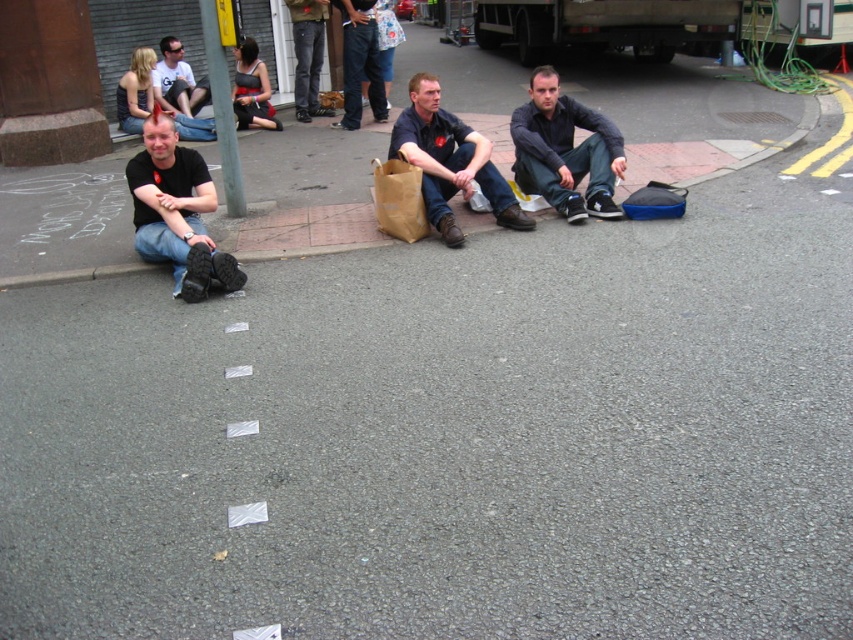
Question: Which point is farther to the camera?

Choices:
 (A) (222, 179)
 (B) (136, 230)
 (C) (161, 93)
 (D) (433, 157)

Answer: (C)

Question: Is black matte shirt at left to the right of brown paper bag at center from the viewer's perspective?

Choices:
 (A) no
 (B) yes

Answer: (A)

Question: Does matte black tank top at upper center come behind matte black t-shirt at upper left?

Choices:
 (A) yes
 (B) no

Answer: (A)

Question: Is black matte shirt at left to the left of dark blue jeans at center from the viewer's perspective?

Choices:
 (A) yes
 (B) no

Answer: (A)

Question: Which point is closer to the camera?

Choices:
 (A) black matte shirt at left
 (B) matte black t-shirt at upper left

Answer: (A)

Question: Among these objects, which one is farthest from the camera?

Choices:
 (A) black matte shirt at left
 (B) matte black tank top at upper center
 (C) matte black t-shirt at upper left
 (D) green wooden pole at upper center

Answer: (B)